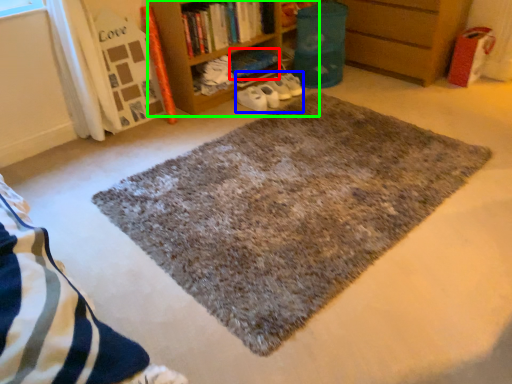
Question: Considering the real-world distances, which object is closest to book (highlighted by a red box)? shoe (highlighted by a blue box) or bookcase (highlighted by a green box).

Choices:
 (A) shoe
 (B) bookcase

Answer: (A)